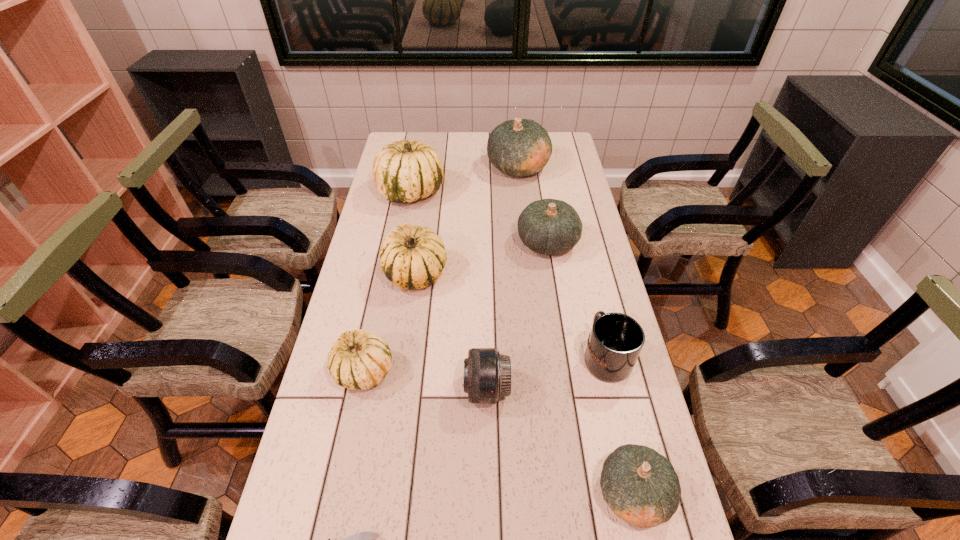
Where is `the biggest orange gourd`? the biggest orange gourd is located at coordinates (521, 147).

You are a GUI agent. You are given a task and a screenshot of the screen. Output one action in this format:
    pyautogui.click(x=<x>, y=<y>)
    Task: Click on the biggest white gourd
    
    Given the screenshot: What is the action you would take?
    pyautogui.click(x=405, y=171)

Find the location of a particular element. The image size is (960, 540). the second biggest orange gourd is located at coordinates (548, 226).

The width and height of the screenshot is (960, 540). I want to click on the second farthest white gourd, so click(412, 257).

The height and width of the screenshot is (540, 960). In order to click on mug in this screenshot , I will do `click(615, 341)`.

You are a GUI agent. You are given a task and a screenshot of the screen. Output one action in this format:
    pyautogui.click(x=<x>, y=<y>)
    Task: Click on the telephoto lens
    Image resolution: width=960 pixels, height=540 pixels.
    Given the screenshot: What is the action you would take?
    pyautogui.click(x=487, y=374)

You are a GUI agent. You are given a task and a screenshot of the screen. Output one action in this format:
    pyautogui.click(x=<x>, y=<y>)
    Task: Click on the nearest orange gourd
    The width and height of the screenshot is (960, 540).
    Given the screenshot: What is the action you would take?
    pyautogui.click(x=641, y=487)

Locate an element on the screen. This screenshot has height=540, width=960. the nearest gourd is located at coordinates (641, 487).

Find the location of a particular element. The height and width of the screenshot is (540, 960). the nearest white gourd is located at coordinates (358, 360).

Find the location of `the second nearest gourd`. the second nearest gourd is located at coordinates (358, 360).